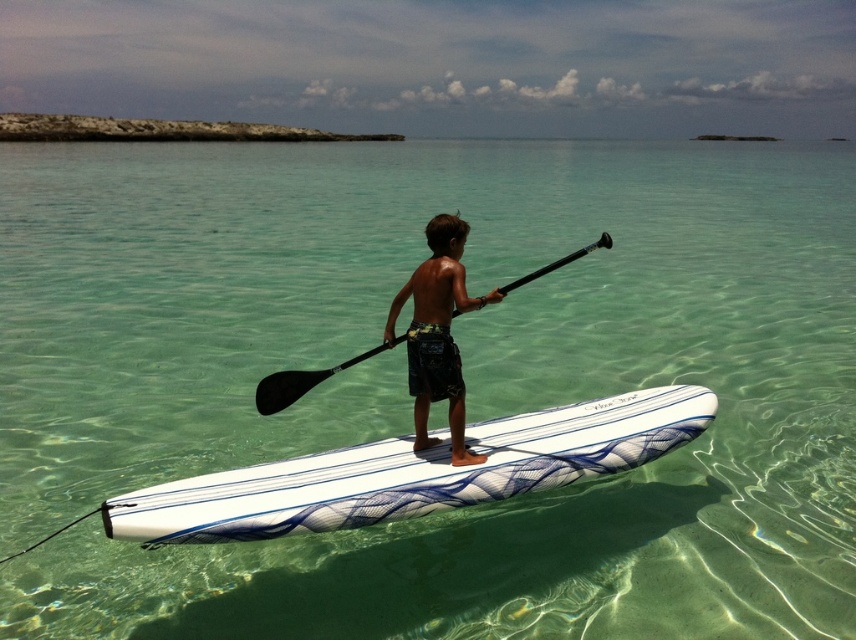
Who is higher up, white glossy surfboard at center or black matte paddle at center?

black matte paddle at center is above.

Which is in front, point (556, 476) or point (345, 364)?

Positioned in front is point (345, 364).

Find the location of a particular element. white glossy surfboard at center is located at coordinates (413, 472).

Identify the location of white glossy surfboard at center. Image resolution: width=856 pixels, height=640 pixels. (413, 472).

Does white glossy surfboard at center appear on the right side of dark brown textured shorts at center?

Correct, you'll find white glossy surfboard at center to the right of dark brown textured shorts at center.

Locate an element on the screen. The width and height of the screenshot is (856, 640). white glossy surfboard at center is located at coordinates (413, 472).

Identify the location of white glossy surfboard at center. (413, 472).

Does point (444, 321) come in front of point (605, 236)?

That is True.

Between point (434, 340) and point (278, 397), which one is positioned in front?

Positioned in front is point (434, 340).

What are the coordinates of `dark brown textured shorts at center` in the screenshot? It's located at (437, 332).